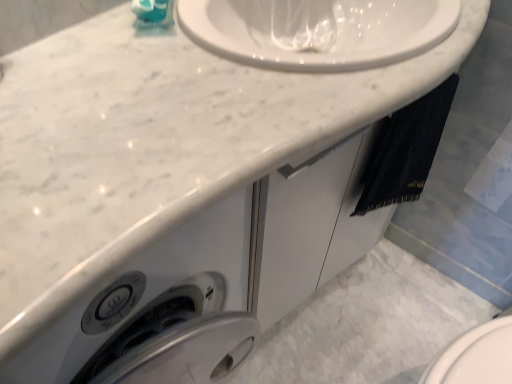
At what (x,y) coordinates should I click in order to perform the action: click on vacant space to the right of teal glossy soap dispenser at upper left. Please return your answer as a coordinate pair (x, y). This screenshot has height=384, width=512. Looking at the image, I should click on (236, 36).